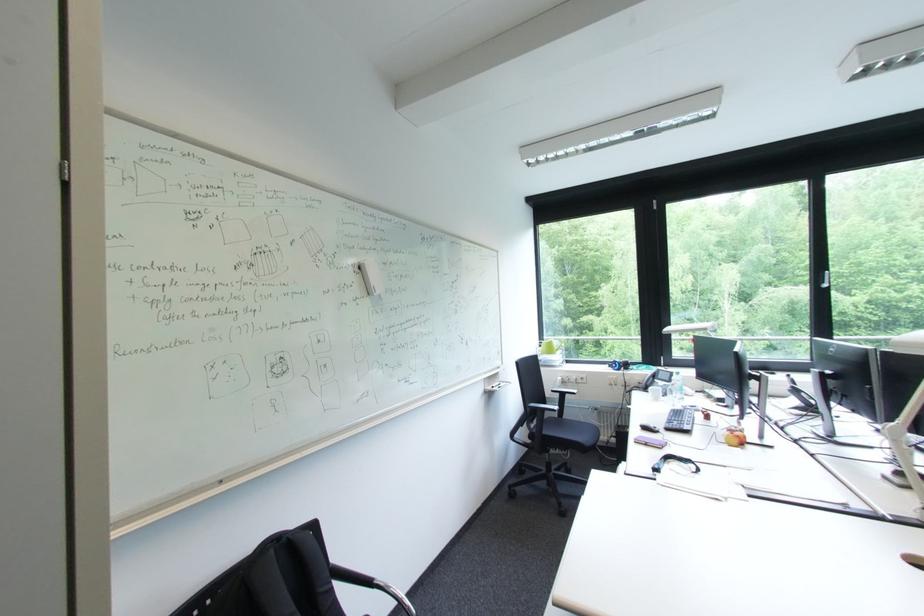
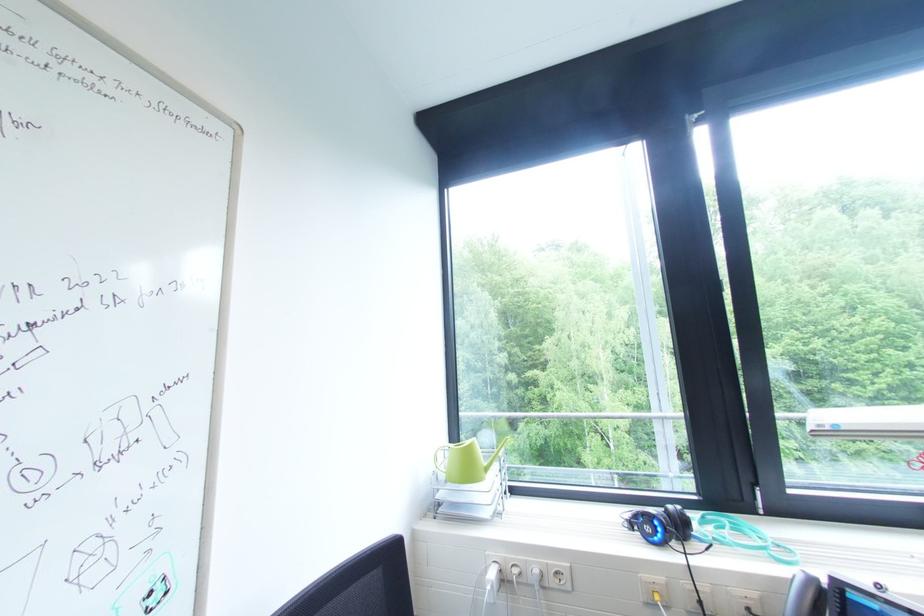
Question: In a continuous first-person perspective shot, in which direction is the camera moving?

Choices:
 (A) Left
 (B) Right
 (C) Forward
 (D) Backward

Answer: (C)